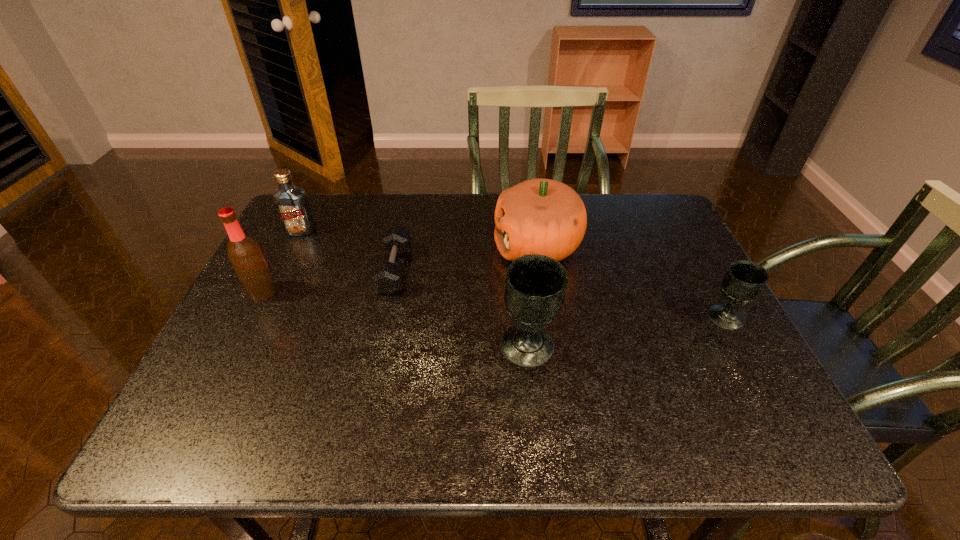
The image size is (960, 540). In order to click on the taller chalice in this screenshot , I will do `click(535, 288)`.

The height and width of the screenshot is (540, 960). I want to click on the right chalice, so click(744, 281).

You are a GUI agent. You are given a task and a screenshot of the screen. Output one action in this format:
    pyautogui.click(x=<x>, y=<y>)
    Task: Click on the rightmost object
    This screenshot has height=540, width=960.
    Given the screenshot: What is the action you would take?
    pyautogui.click(x=744, y=281)

Image resolution: width=960 pixels, height=540 pixels. I want to click on pumpkin, so click(x=546, y=217).

Identify the location of vodka. The image size is (960, 540). (291, 202).

Identify the location of dumbbell. (387, 277).

Locate an element on the screen. The width and height of the screenshot is (960, 540). the fourth object from right to left is located at coordinates (387, 277).

This screenshot has height=540, width=960. Find the location of `beer bottle`. beer bottle is located at coordinates (244, 253).

The image size is (960, 540). What are the coordinates of `vacant region located on the back of the taller chalice` in the screenshot? It's located at (518, 251).

Identify the location of vacant area situated on the left of the second shortest object. The width and height of the screenshot is (960, 540). (586, 318).